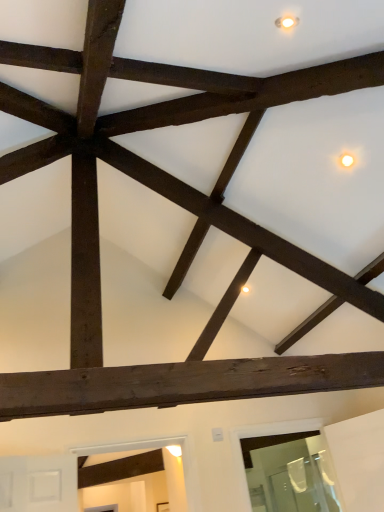
The image size is (384, 512). What do you see at coordinates (289, 472) in the screenshot?
I see `white frosted glass window at lower right` at bounding box center [289, 472].

Where is `white frosted glass window at lower right`? The width and height of the screenshot is (384, 512). white frosted glass window at lower right is located at coordinates (289, 472).

At what (x,y) coordinates should I click in order to perform the action: click on white frosted glass window at lower right. Please return your answer as a coordinate pair (x, y). Looking at the image, I should click on (289, 472).